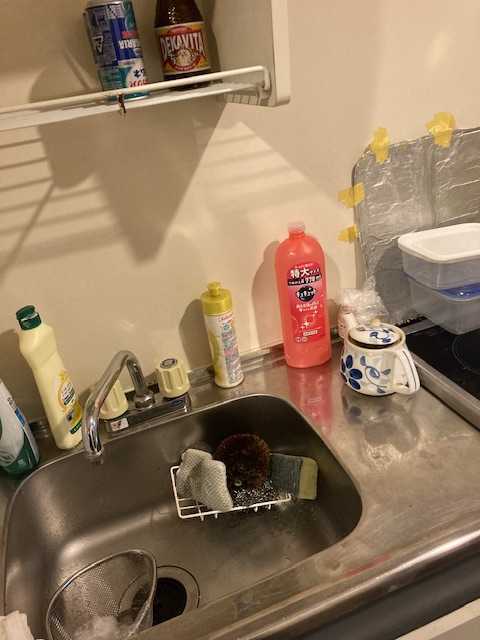
This screenshot has height=640, width=480. Find the location of `tupperware`. tupperware is located at coordinates (462, 314).